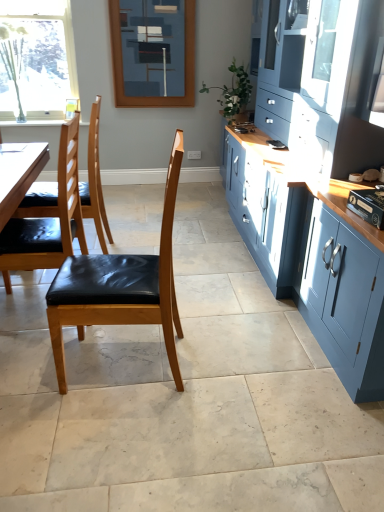
Where is `free space in front of matte wood chair at left, which is the first chair from front to back`? The height and width of the screenshot is (512, 384). free space in front of matte wood chair at left, which is the first chair from front to back is located at coordinates (110, 431).